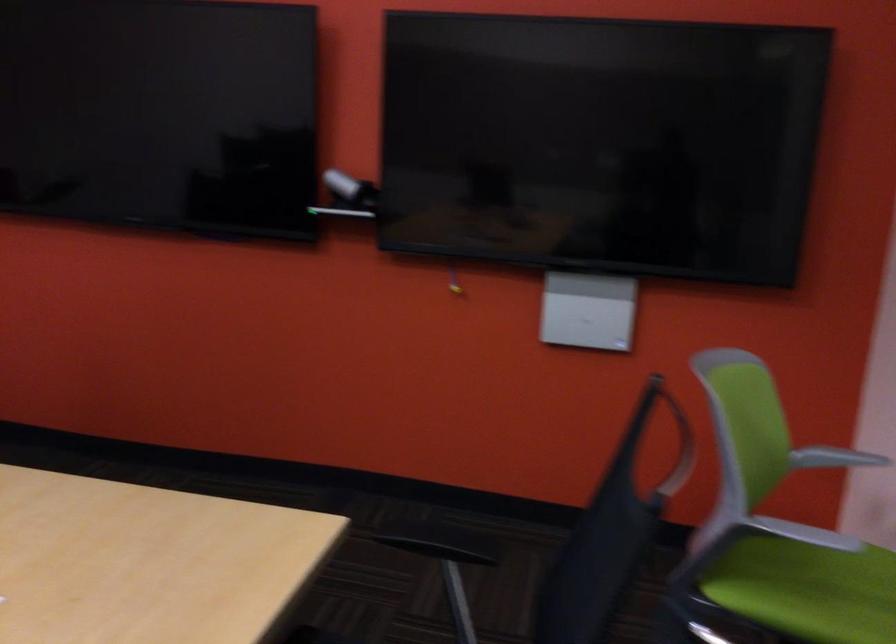
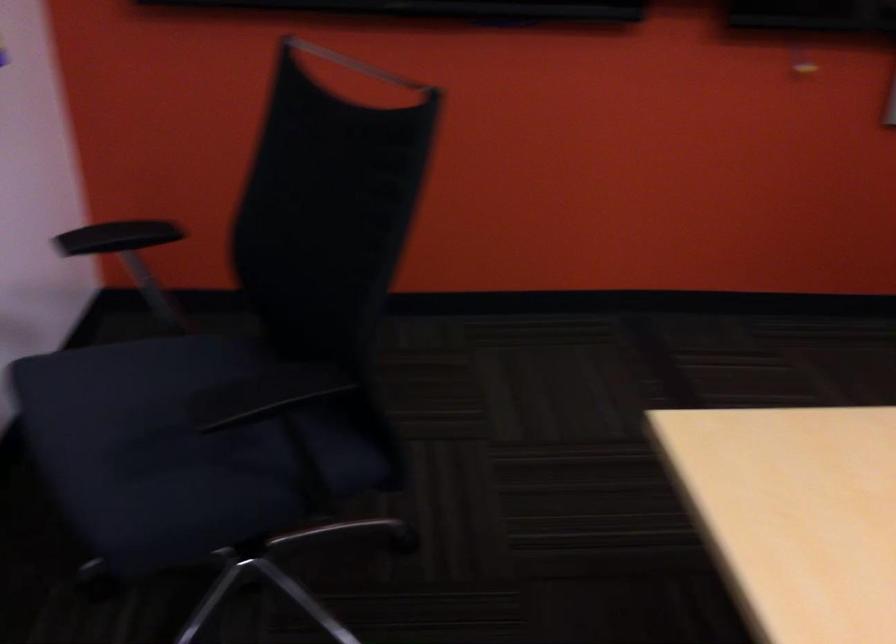
Locate, in the second image, the point that corresponds to (114,247) in the first image.

(356, 64)